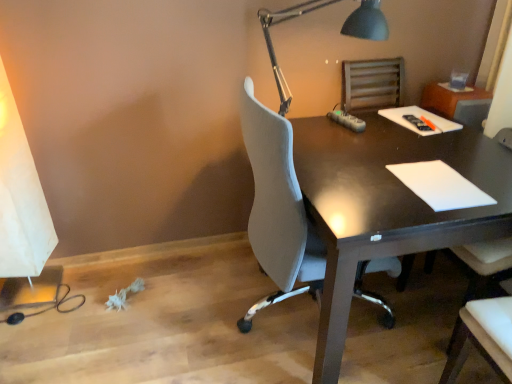
Where is `free space between metallic gray desk lamp at upper right and white matte notepad at right`? This screenshot has width=512, height=384. free space between metallic gray desk lamp at upper right and white matte notepad at right is located at coordinates [x=371, y=164].